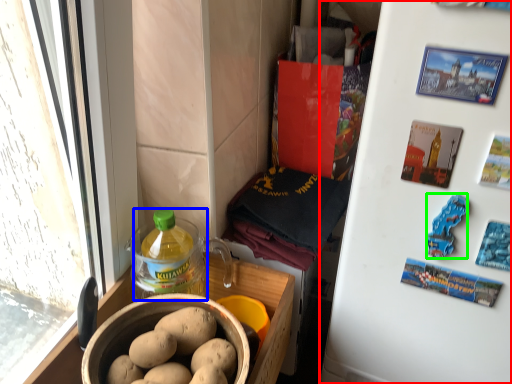
Question: Which object is the farthest from refrigerator (highlighted by a red box)? Choose among these: bottle (highlighted by a blue box) or food (highlighted by a green box).

Choices:
 (A) bottle
 (B) food

Answer: (A)